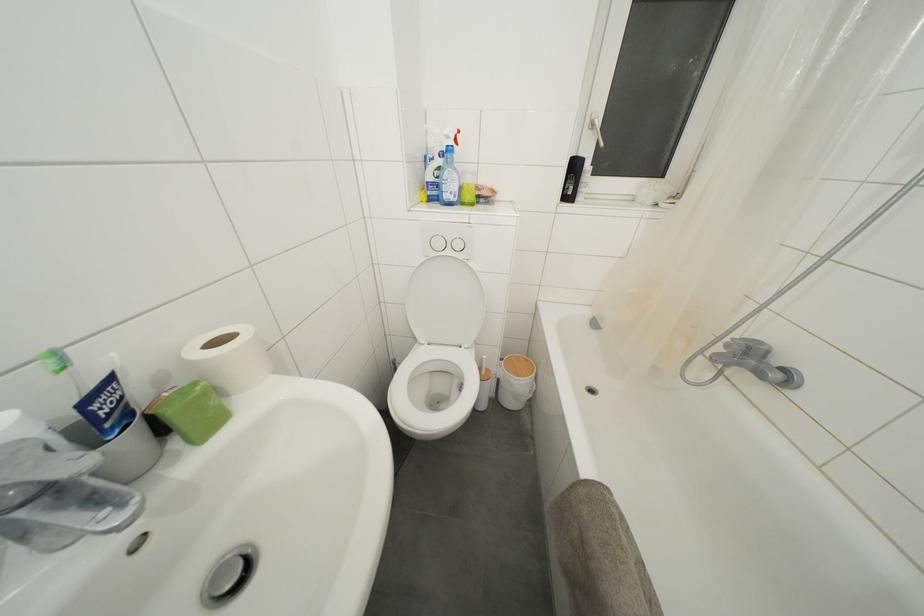
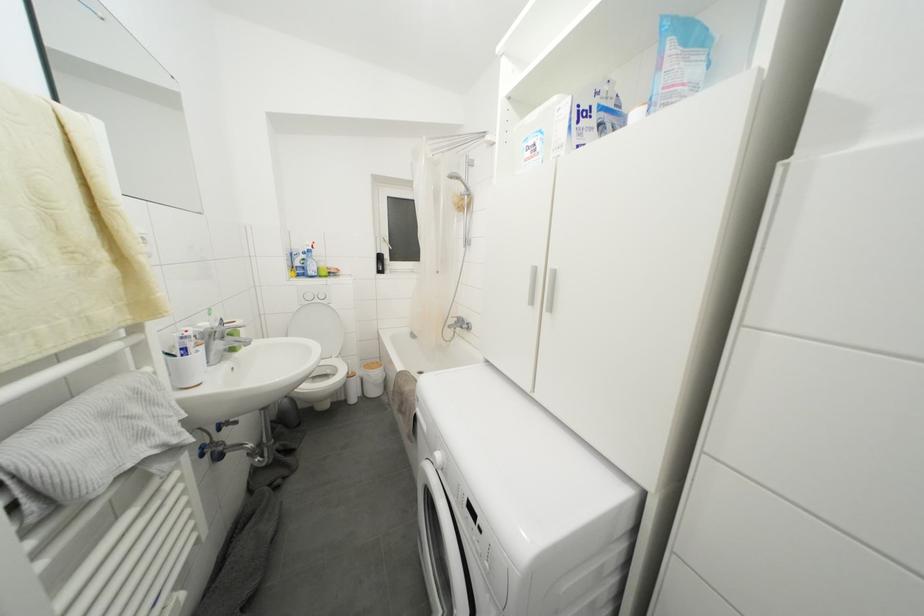
Locate, in the second image, the point that corresponds to (x=444, y=172) in the first image.

(308, 264)